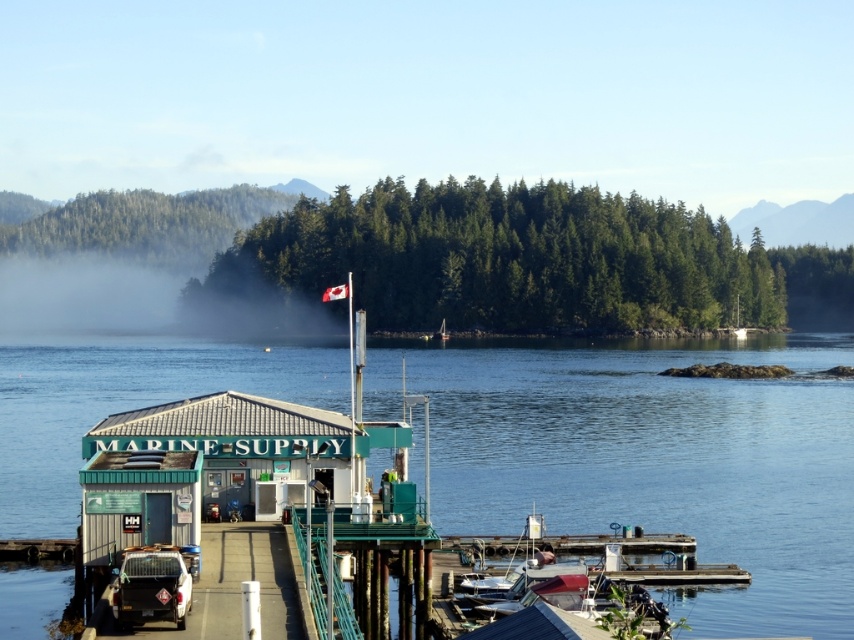
You are planning to take a photo of the waterfront scene. You want to include both the clear blue water at center and the white matte truck at lower left in the frame. Which object should you focus on to ensure both are visible without zooming in or out?

The clear blue water at center is larger in size compared to the white matte truck at lower left, so focusing on the clear blue water at center will help ensure both objects are visible in the frame without needing to adjust the zoom.

You are standing at the waterfront scene and want to know if the clear blue water at center is higher than the white matte truck at lower left. Can you confirm this based on the scene?

The clear blue water at center is taller than white matte truck at lower left, so yes, the clear blue water at center is higher than the white matte truck at lower left.